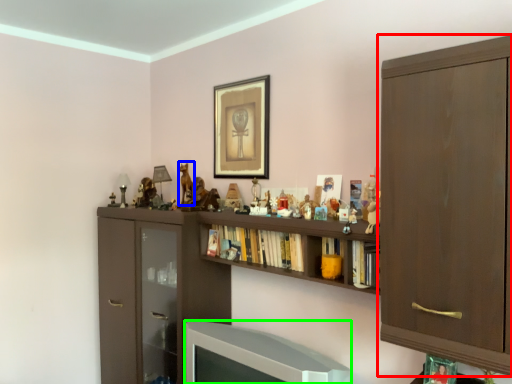
Question: Based on their relative distances, which object is nearer to cabinetry (highlighted by a red box)? Choose from animal (highlighted by a blue box) and television (highlighted by a green box).

Choices:
 (A) animal
 (B) television

Answer: (B)